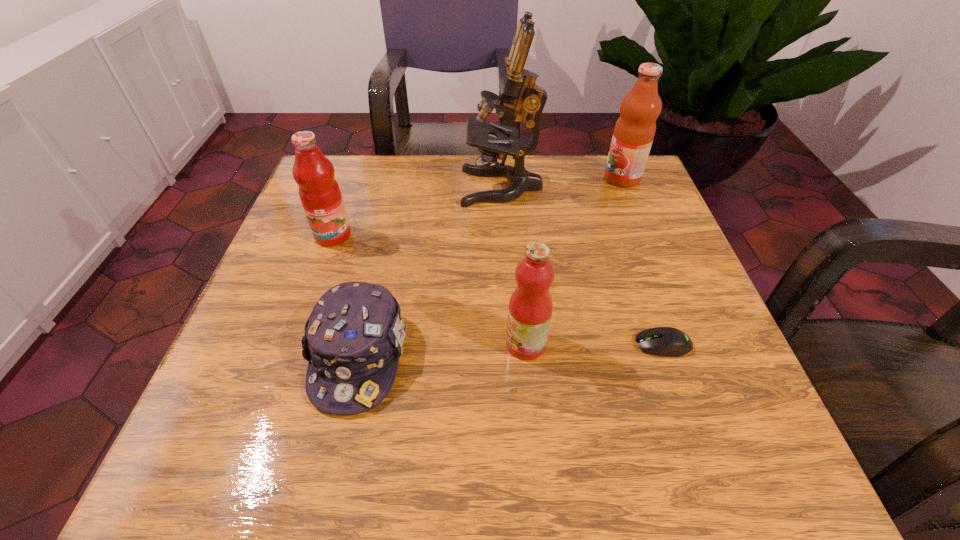
Identify the location of vacant space located on the front label of the farthest fruit juice. The width and height of the screenshot is (960, 540). (444, 178).

This screenshot has height=540, width=960. In order to click on vacant space situated on the front label of the farthest fruit juice in this screenshot , I will do `click(524, 178)`.

Find the location of a particular element. vacant region located 0.170m on the front label of the farthest fruit juice is located at coordinates (536, 178).

You are a GUI agent. You are given a task and a screenshot of the screen. Output one action in this format:
    pyautogui.click(x=<x>, y=<y>)
    Task: Click on the free point located on the front label of the second nearest fruit juice
    
    Given the screenshot: What is the action you would take?
    pyautogui.click(x=299, y=333)

Locate an element on the screen. Image resolution: width=960 pixels, height=540 pixels. free location located on the front label of the second fruit juice from left to right is located at coordinates (348, 344).

Find the location of a particular element. This screenshot has height=540, width=960. vacant area located 0.350m on the front label of the second fruit juice from left to right is located at coordinates (301, 344).

The width and height of the screenshot is (960, 540). What are the coordinates of `free space located 0.210m on the front label of the second fruit juice from left to right` in the screenshot? It's located at (383, 344).

Where is `vacant space located 0.090m on the front-facing side of the headwear`? The image size is (960, 540). vacant space located 0.090m on the front-facing side of the headwear is located at coordinates (331, 480).

Find the location of a particular element. The height and width of the screenshot is (540, 960). vacant space located 0.080m on the wheel side of the computer mouse is located at coordinates (588, 345).

At what (x,y) coordinates should I click in order to perform the action: click on vacant position located 0.150m on the wheel side of the computer mouse. Please return your answer as a coordinate pair (x, y). The image size is (960, 540). Looking at the image, I should click on (546, 345).